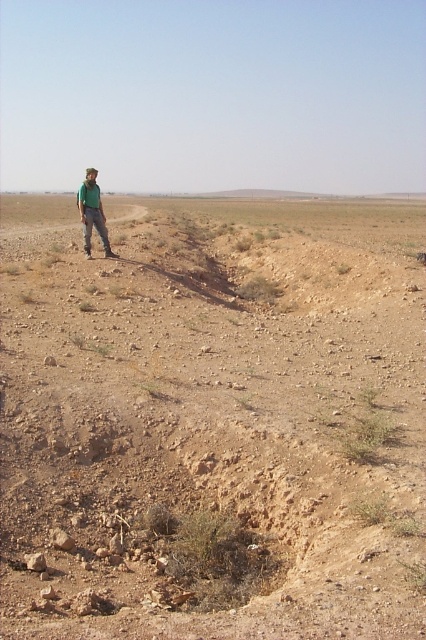
You are a hiker lost in the desert and see the dusty brown dirt field at center and the green matte shirt at left. Which object is larger in size?

The dusty brown dirt field at center is bigger than the green matte shirt at left.

You are navigating a drone over a desert landscape and need to land it precisely on the dusty brown dirt field at center. According to the coordinates provided, is the field positioned closer to the top or bottom half of the image?

The dusty brown dirt field at center is located at point 0.658 on the vertical axis, which places it closer to the bottom half of the image since 0.658 is below the midpoint of 0.5.

You are an archaeologist examining the dusty brown dirt field at center and the green matte shirt at left. Which object is wider?

The dusty brown dirt field at center is wider than the green matte shirt at left.